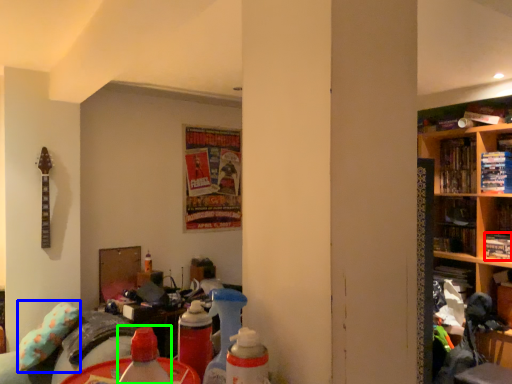
Question: Estimate the real-world distances between objects in this image. Which object is farther from book (highlighted by a red box), pillow (highlighted by a blue box) or bottle (highlighted by a green box)?

Choices:
 (A) pillow
 (B) bottle

Answer: (B)